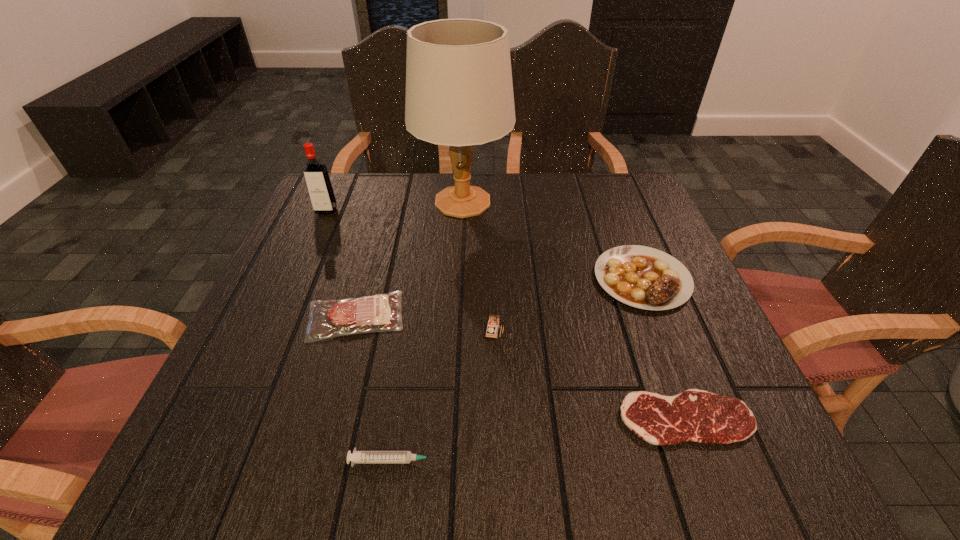
The width and height of the screenshot is (960, 540). Find the location of `vodka that is positioned at the left edge`. vodka that is positioned at the left edge is located at coordinates (317, 179).

Find the location of a particular element. This screenshot has height=540, width=960. steak located in the left edge section of the desktop is located at coordinates (381, 312).

Identify the location of object that is positioned at the far left corner. (317, 179).

Image resolution: width=960 pixels, height=540 pixels. Identify the location of object situated at the near right corner. (695, 415).

Where is `free space at the far edge`? Image resolution: width=960 pixels, height=540 pixels. free space at the far edge is located at coordinates (413, 176).

In the image, there is a desktop. At what (x,y) coordinates should I click in order to perform the action: click on free space at the near edge. Please return your answer as a coordinate pair (x, y). Image resolution: width=960 pixels, height=540 pixels. Looking at the image, I should click on 315,448.

You are a GUI agent. You are given a task and a screenshot of the screen. Output one action in this format:
    pyautogui.click(x=<x>, y=<y>)
    Task: Click on the vacant space at the left edge of the desktop
    Image resolution: width=960 pixels, height=540 pixels.
    Given the screenshot: What is the action you would take?
    pyautogui.click(x=304, y=224)

You are a GUI agent. You are given a task and a screenshot of the screen. Output one action in this format:
    pyautogui.click(x=<x>, y=<y>)
    Task: Click on the blank space at the right edge
    The height and width of the screenshot is (540, 960).
    Given the screenshot: What is the action you would take?
    pyautogui.click(x=673, y=371)

The width and height of the screenshot is (960, 540). I want to click on free space at the far left corner of the desktop, so click(360, 188).

You are a GUI agent. You are given a task and a screenshot of the screen. Output one action in this format:
    pyautogui.click(x=<x>, y=<y>)
    Task: Click on the vacant space at the far right corner of the desktop
    
    Given the screenshot: What is the action you would take?
    pyautogui.click(x=636, y=204)